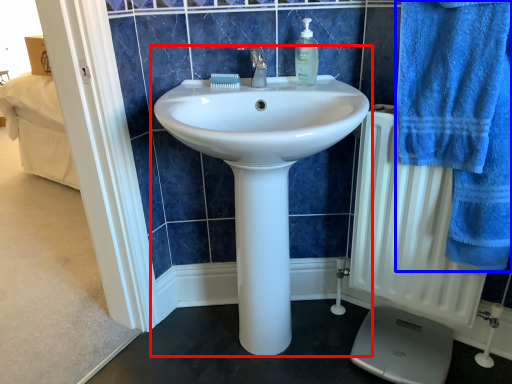
Question: Which object is further to the camera taking this photo, sink (highlighted by a red box) or bath towel (highlighted by a blue box)?

Choices:
 (A) sink
 (B) bath towel

Answer: (A)